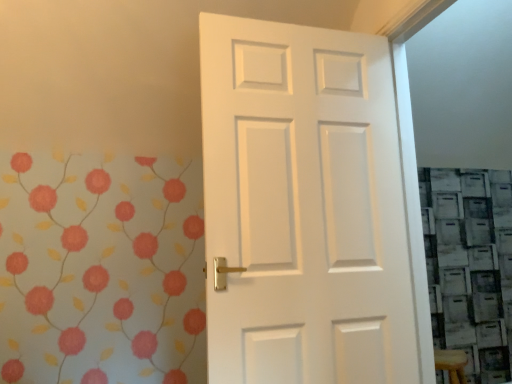
Describe the element at coordinates (303, 207) in the screenshot. I see `white matte door at center` at that location.

Where is `white matte door at center`? This screenshot has height=384, width=512. white matte door at center is located at coordinates (303, 207).

You are a GUI agent. You are given a task and a screenshot of the screen. Output one action in this format:
    pyautogui.click(x=<x>, y=<y>)
    Task: Click on the white matte door at center
    Image resolution: width=512 pixels, height=384 pixels.
    Given the screenshot: What is the action you would take?
    pyautogui.click(x=303, y=207)